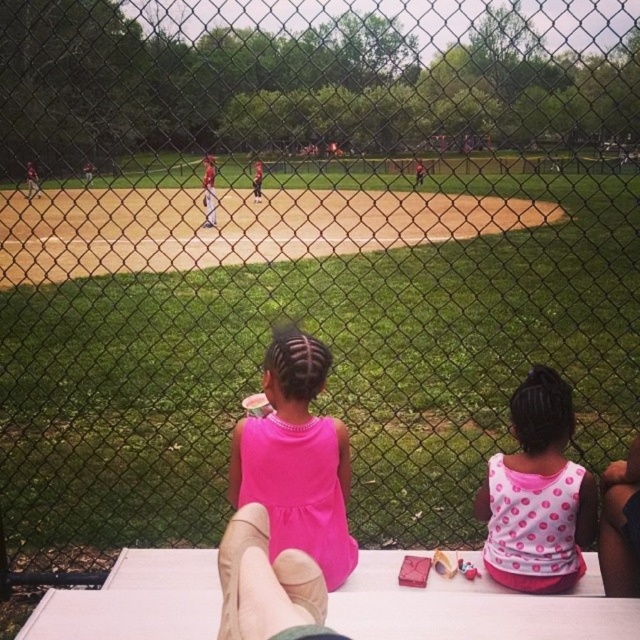
You are standing at the entrance of the baseball field and want to sit down at the white wood picnic table at lower center. Based on its 2D coordinates, in which general direction should you walk from your current position to reach it?

The white wood picnic table at lower center is located at coordinates point (472, 608), which is towards the lower center of the image. To reach it, you should walk towards the lower center direction from your current position.

You are a photographer trying to capture a photo of both the white wood picnic table at lower center and the pink matte dress at center. Based on their positions, which object should you adjust your camera angle to focus on first to ensure both are in frame?

The white wood picnic table at lower center is to the right of the pink matte dress at center, so you should adjust your camera angle to focus on the pink matte dress at center first to ensure both are in frame.

You are a photographer trying to capture a closeup of both the pink matte dress at center and the pink polka dot tank top at center in the image. Given that your camera has a maximum focus range of 30 inches, will you be able to capture both items clearly in the same shot?

The pink matte dress at center and the pink polka dot tank top at center are 31.58 inches apart, which exceeds the camera maximum focus range of 30 inches. Therefore, you won not be able to capture both items clearly in the same shot.